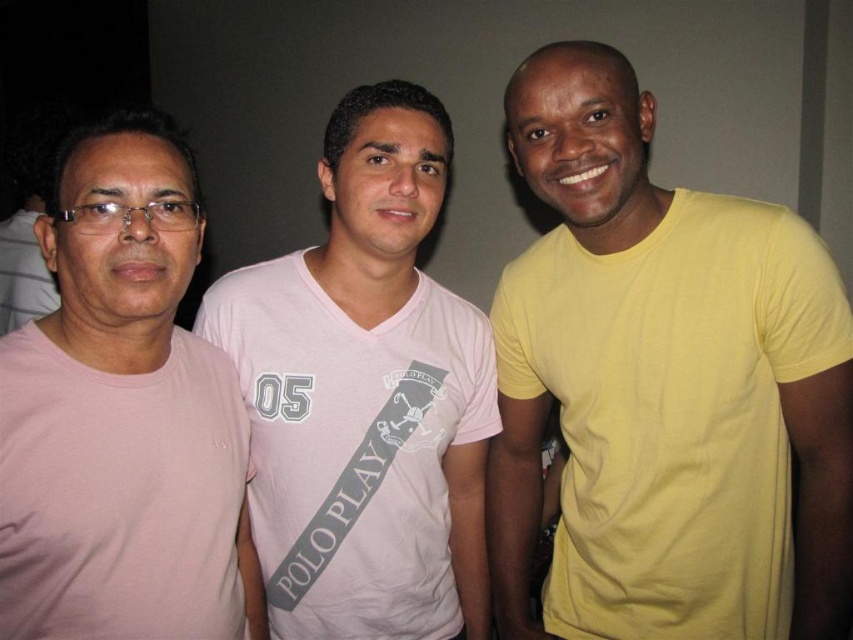
Question: Which object is positioned closest to the pink matte t-shirt at left?

Choices:
 (A) pink cotton t-shirt at center
 (B) yellow matte t-shirt at right

Answer: (A)

Question: Which object is farther from the camera taking this photo?

Choices:
 (A) yellow matte t-shirt at right
 (B) pink matte t-shirt at left

Answer: (A)

Question: Does pink cotton t-shirt at center appear on the left side of pink matte t-shirt at left?

Choices:
 (A) yes
 (B) no

Answer: (B)

Question: Which of the following is the closest to the observer?

Choices:
 (A) (149, 205)
 (B) (537, 56)
 (C) (316, 275)

Answer: (A)

Question: Can you confirm if pink cotton t-shirt at center is positioned to the right of pink matte t-shirt at left?

Choices:
 (A) no
 (B) yes

Answer: (B)

Question: Can you confirm if pink cotton t-shirt at center is positioned above pink matte t-shirt at left?

Choices:
 (A) yes
 (B) no

Answer: (A)